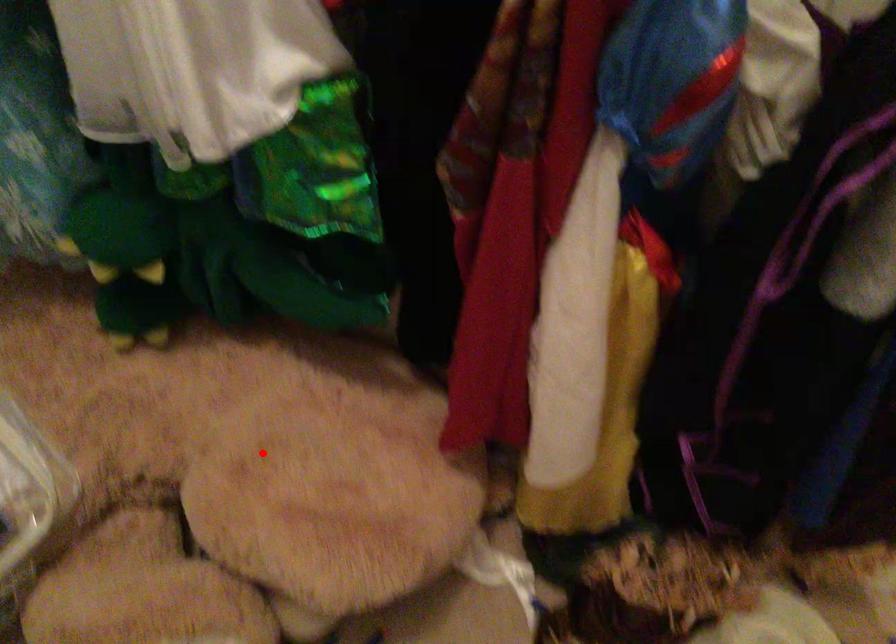
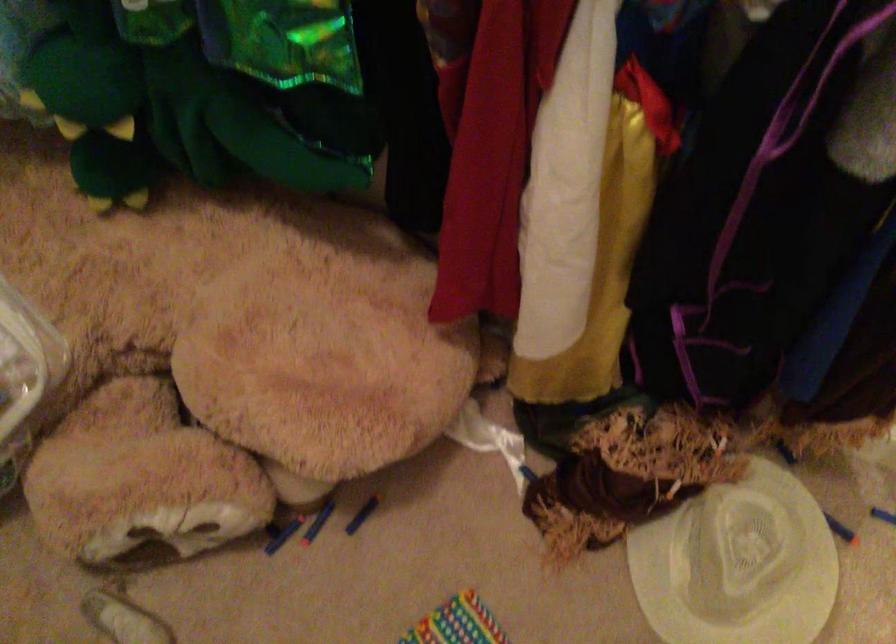
Locate, in the second image, the point that corresponds to the highlighted location in the first image.

(247, 321)